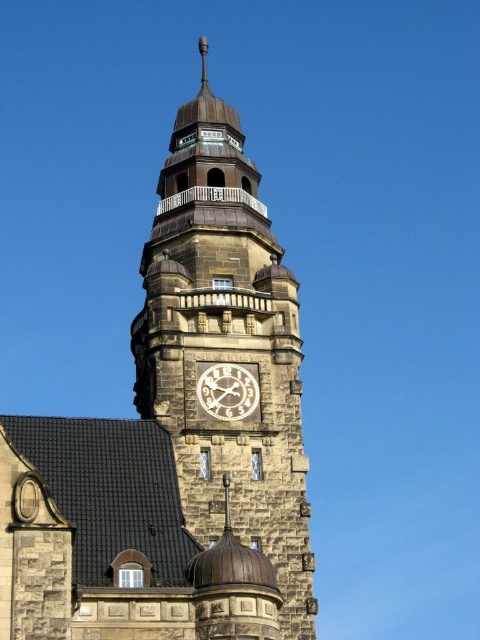
Question: Is stone clock tower at center further to the viewer compared to white wooden clock at center?

Choices:
 (A) yes
 (B) no

Answer: (B)

Question: Among these points, which one is nearest to the camera?

Choices:
 (A) (56, 579)
 (B) (251, 392)

Answer: (A)

Question: Which object is closer to the camera taking this photo?

Choices:
 (A) white wooden clock at center
 (B) stone clock tower at center

Answer: (B)

Question: Does stone clock tower at center appear on the left side of white wooden clock at center?

Choices:
 (A) no
 (B) yes

Answer: (B)

Question: Is stone clock tower at center positioned in front of white wooden clock at center?

Choices:
 (A) yes
 (B) no

Answer: (A)